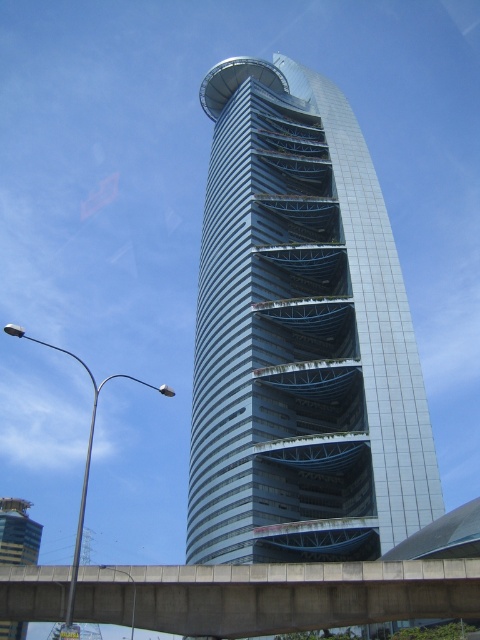
Question: Can you confirm if metallic glass tower at center is thinner than metallic silver tower at lower left?

Choices:
 (A) no
 (B) yes

Answer: (B)

Question: Which of the following is the closest to the observer?

Choices:
 (A) concrete bridge at center
 (B) metallic glass tower at center
 (C) metallic silver tower at lower left

Answer: (A)

Question: Estimate the real-world distances between objects in this image. Which object is closer to the concrete bridge at center?

Choices:
 (A) metallic silver tower at lower left
 (B) metallic glass tower at center

Answer: (B)

Question: Estimate the real-world distances between objects in this image. Which object is closer to the metallic silver tower at lower left?

Choices:
 (A) metallic glass tower at center
 (B) concrete bridge at center

Answer: (B)

Question: Is concrete bridge at center wider than metallic silver tower at lower left?

Choices:
 (A) no
 (B) yes

Answer: (A)

Question: Does metallic glass tower at center appear on the left side of concrete bridge at center?

Choices:
 (A) yes
 (B) no

Answer: (A)